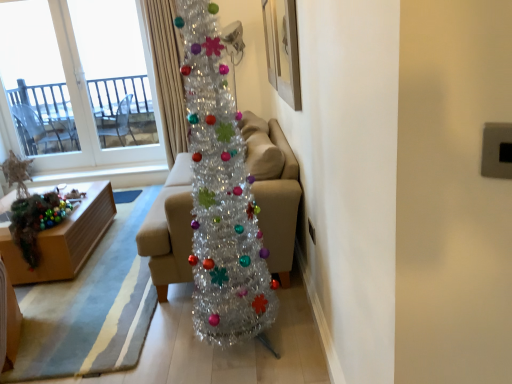
The image size is (512, 384). In order to click on free space in front of shiny metallic christmas tree at center in this screenshot , I will do `click(245, 370)`.